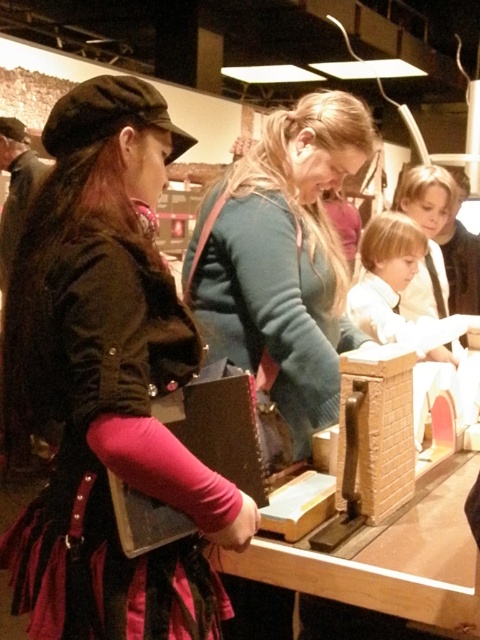
You are an event organizer at the exhibition and need to arrange seating for a presentation. The velvet black jacket at center and the teal sweater at center are currently blocking the aisle. Which clothing item should you move first to clear the path?

The velvet black jacket at center is positioned under the teal sweater at center, so you should move the teal sweater at center first to clear the path.

You are a photographer positioned at the entrance of the exhibition hall. You want to take a photo of the wooden table at center without the velvet black jacket at center blocking the view. Is it possible to adjust your position to achieve this?

The velvet black jacket at center is in front of the wooden table at center, so moving to a position behind the jacket could allow you to see the table beyond it. However, since both are at center, shifting your angle slightly might help frame the table without the jacket obstructing the view.

You are a person who needs to place a 18 inch wide box on the wooden table at center. Can you fit the box on the table if you are standing at the velvet black jacket at center position?

The distance between the velvet black jacket at center and the wooden table at center is 17.40 inches. Since the box is 18 inches wide, it would not fit within the available space. You would need to adjust the placement or choose a smaller box.